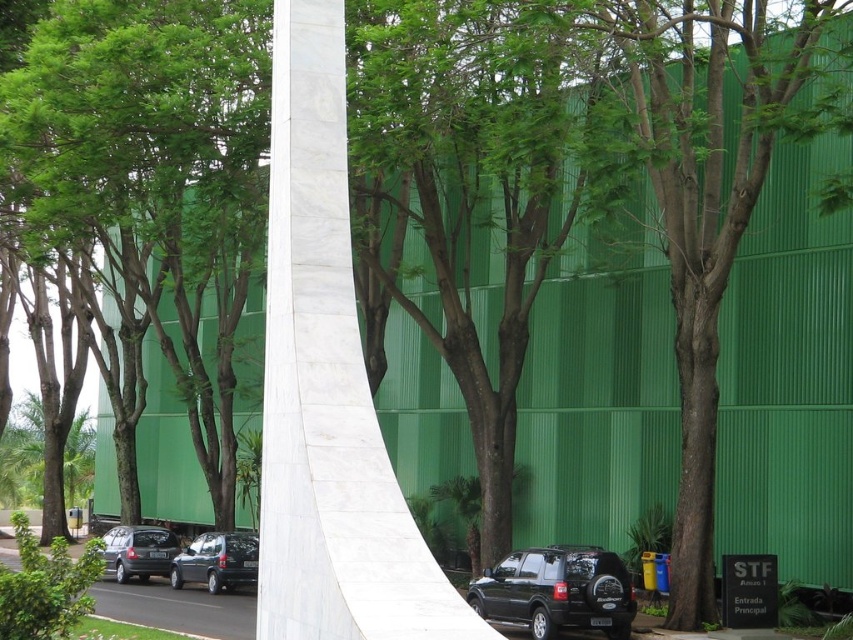
Question: Which object is positioned closest to the black matte suv at lower center?

Choices:
 (A) matte black car at center
 (B) white marble pillar at center

Answer: (A)

Question: In this image, where is matte black car at center located relative to matte black suv at center?

Choices:
 (A) above
 (B) below

Answer: (A)

Question: Which of the following is the farthest from the observer?

Choices:
 (A) matte black car at center
 (B) white marble pillar at center
 (C) matte black suv at center
 (D) black matte suv at lower center

Answer: (C)

Question: Does matte black car at center have a smaller size compared to matte black suv at center?

Choices:
 (A) yes
 (B) no

Answer: (B)

Question: Which point is farther to the camera?

Choices:
 (A) matte black suv at center
 (B) matte black car at center

Answer: (A)

Question: From the image, what is the correct spatial relationship of black matte suv at lower center in relation to matte black car at center?

Choices:
 (A) left
 (B) right

Answer: (B)